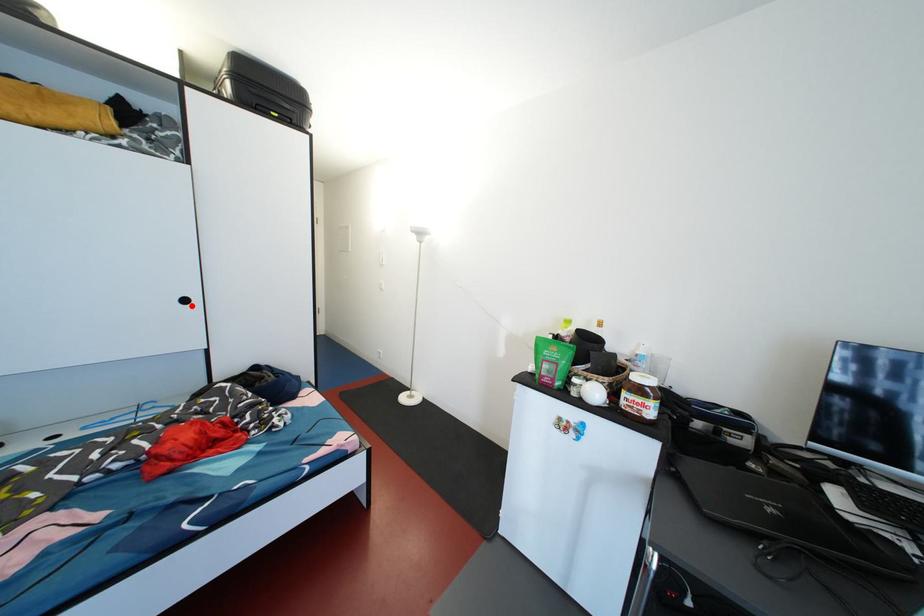
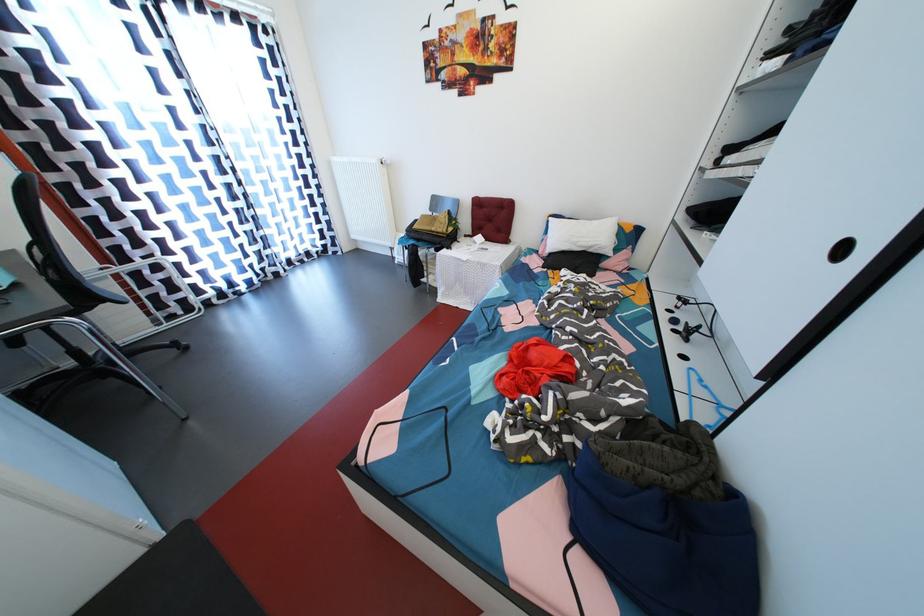
In the second image, find the point that corresponds to the highlighted location in the first image.

(848, 254)